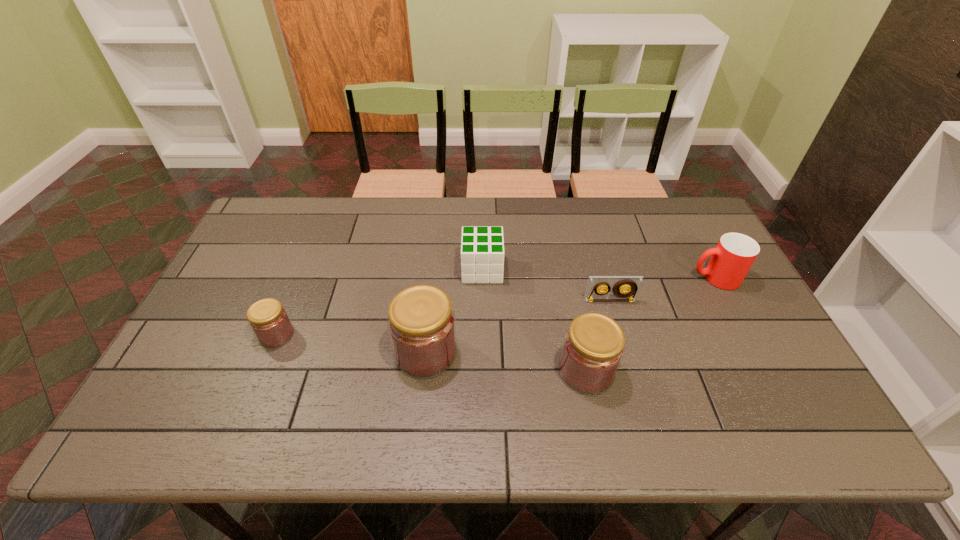
Given the evenly spaced jams in the image, where should an extra jam be added on the right to preserve the spacing? Please point to a vacant space. Please provide its 2D coordinates. Your answer should be formatted as a tuple, i.e. [(x, y)], where the tuple contains the x and y coordinates of a point satisfying the conditions above.

[(758, 392)]